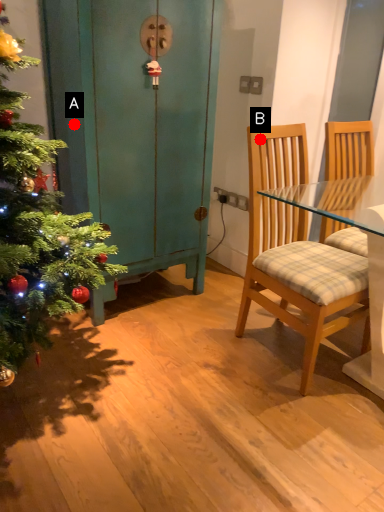
Question: Two points are circled on the image, labeled by A and B beside each circle. Which of the following is the closest to the observer?

Choices:
 (A) A is closer
 (B) B is closer

Answer: (B)